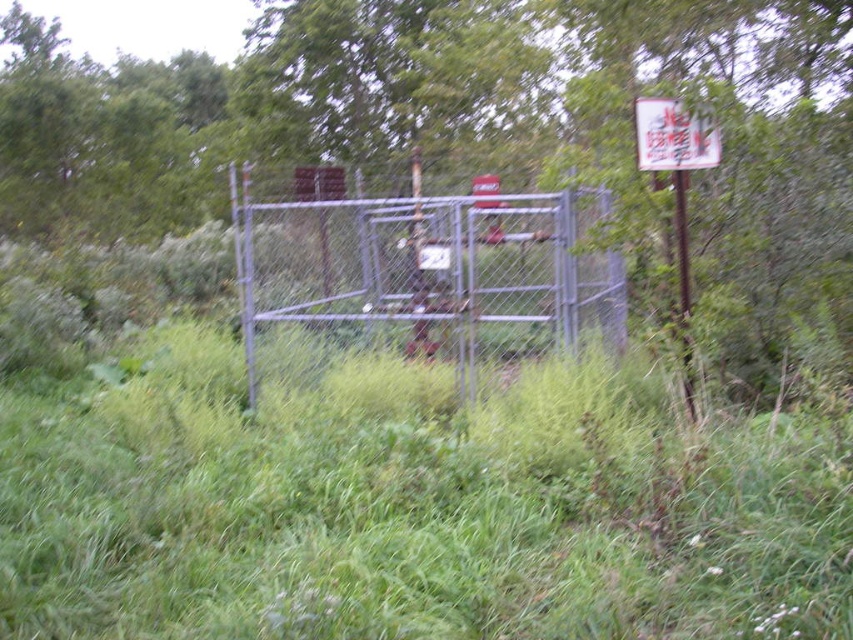
Question: Does green grass at center have a smaller size compared to metallic chain-link fence at center?

Choices:
 (A) yes
 (B) no

Answer: (B)

Question: Is metallic chain-link fence at center to the right of white paper sign at upper right from the viewer's perspective?

Choices:
 (A) no
 (B) yes

Answer: (A)

Question: Which object appears farthest from the camera in this image?

Choices:
 (A) white paper sign at upper right
 (B) metallic chain-link fence at center
 (C) green grass at center

Answer: (B)

Question: Among these points, which one is farthest from the camera?

Choices:
 (A) (419, 211)
 (B) (451, 65)

Answer: (B)

Question: Among these objects, which one is nearest to the camera?

Choices:
 (A) green grass at center
 (B) white paper sign at upper right
 (C) green leafy tree at upper center
 (D) metallic chain-link fence at center

Answer: (A)

Question: Does metallic chain-link fence at center appear over white paper sign at upper right?

Choices:
 (A) no
 (B) yes

Answer: (A)